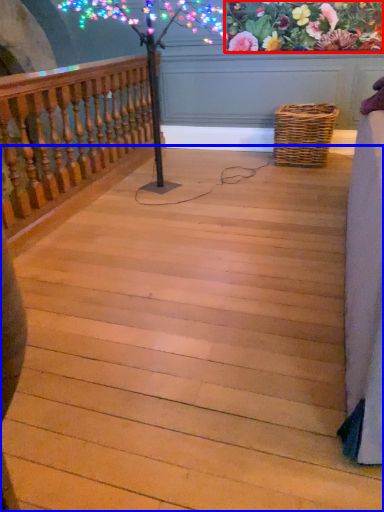
Question: Which object is further to the camera taking this photo, floral arrangement (highlighted by a red box) or stairs (highlighted by a blue box)?

Choices:
 (A) floral arrangement
 (B) stairs

Answer: (A)